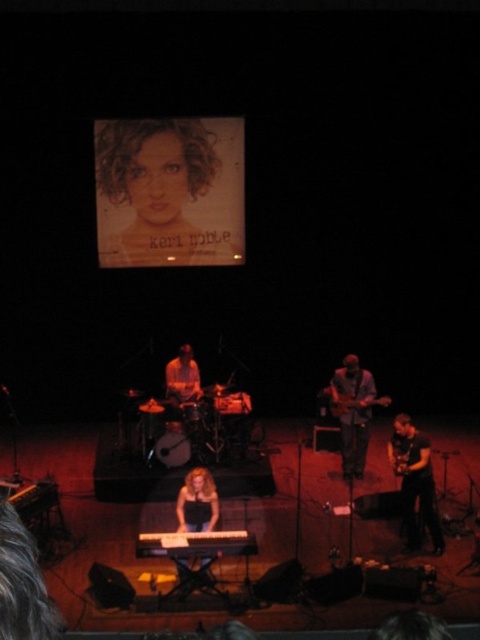
Question: Is blonde hair at center further to camera compared to glossy wood guitar at center?

Choices:
 (A) no
 (B) yes

Answer: (A)

Question: Is the position of curly hair at upper center more distant than that of black matte keyboard at center?

Choices:
 (A) yes
 (B) no

Answer: (A)

Question: Is black matte keyboard at center thinner than glossy wood guitar at center?

Choices:
 (A) yes
 (B) no

Answer: (B)

Question: Among these objects, which one is nearest to the camera?

Choices:
 (A) matte brown guitar at center
 (B) black matte keyboard at center
 (C) glossy wood guitar at center

Answer: (B)

Question: Among these objects, which one is nearest to the camera?

Choices:
 (A) dark gray jeans at center
 (B) black matte keyboard at center
 (C) curly hair at upper center
 (D) glossy wood guitar at center

Answer: (B)

Question: Estimate the real-world distances between objects in this image. Which object is closer to the dark gray jeans at center?

Choices:
 (A) blonde hair at center
 (B) black matte guitar at lower right
 (C) black matte keyboard at center

Answer: (B)